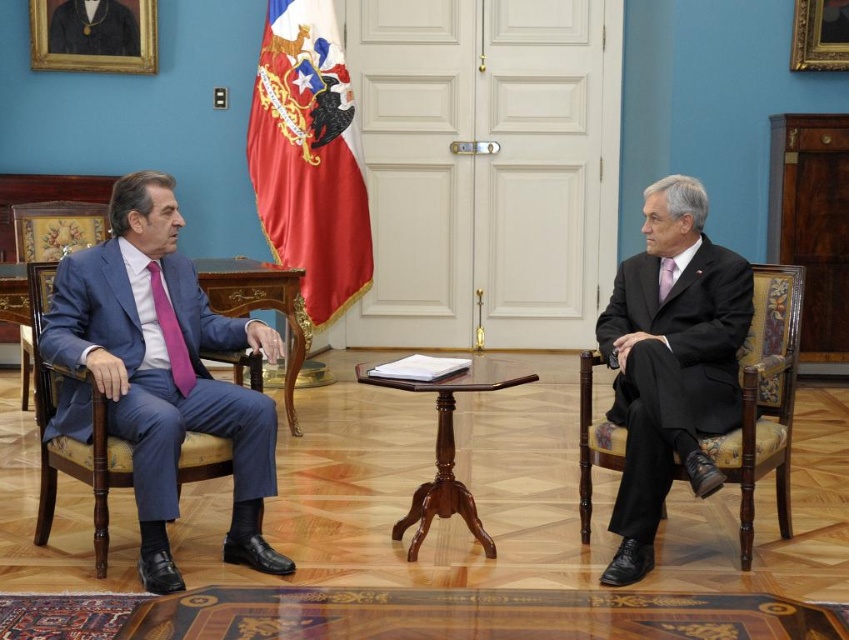
Question: Which point appears farthest from the camera in this image?

Choices:
 (A) (291, 349)
 (B) (782, 324)

Answer: (A)

Question: Which of these objects is positioned farthest from the velvet upholstered chair at right?

Choices:
 (A) red fabric flag at upper center
 (B) mahogany wood table at center
 (C) wooden polished table at center
 (D) blue upholstered chair at left

Answer: (A)

Question: Does red fabric flag at upper center have a larger size compared to pink satin tie at right?

Choices:
 (A) yes
 (B) no

Answer: (A)

Question: Does red fabric flag at upper center lie in front of mahogany wood table at center?

Choices:
 (A) no
 (B) yes

Answer: (A)

Question: Which object is positioned closest to the red fabric flag at upper center?

Choices:
 (A) velvet upholstered chair at right
 (B) pink satin tie at right
 (C) wooden polished table at center
 (D) blue upholstered chair at left

Answer: (C)

Question: Considering the relative positions of mahogany wood table at center and wooden polished table at center in the image provided, where is mahogany wood table at center located with respect to wooden polished table at center?

Choices:
 (A) left
 (B) right

Answer: (B)